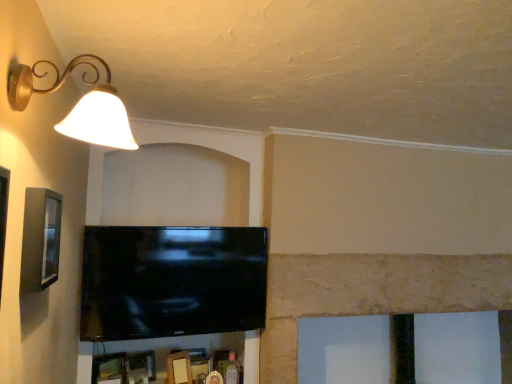
Question: Considering the relative positions of matte gold lampshade at upper left and black glossy tv at center in the image provided, is matte gold lampshade at upper left to the right of black glossy tv at center from the viewer's perspective?

Choices:
 (A) yes
 (B) no

Answer: (B)

Question: Can you confirm if matte gold lampshade at upper left is positioned to the left of black glossy tv at center?

Choices:
 (A) no
 (B) yes

Answer: (B)

Question: Is matte gold lampshade at upper left with black glossy tv at center?

Choices:
 (A) no
 (B) yes

Answer: (A)

Question: From a real-world perspective, is matte gold lampshade at upper left physically below black glossy tv at center?

Choices:
 (A) yes
 (B) no

Answer: (B)

Question: Can you confirm if matte gold lampshade at upper left is thinner than black glossy tv at center?

Choices:
 (A) yes
 (B) no

Answer: (B)

Question: From a real-world perspective, relative to matte gray picture frame at left, is matte gold lampshade at upper left vertically above or below?

Choices:
 (A) below
 (B) above

Answer: (B)

Question: From the image's perspective, is matte gold lampshade at upper left above or below matte gray picture frame at left?

Choices:
 (A) below
 (B) above

Answer: (B)

Question: Relative to matte gray picture frame at left, is matte gold lampshade at upper left in front or behind?

Choices:
 (A) front
 (B) behind

Answer: (A)

Question: In terms of width, does matte gold lampshade at upper left look wider or thinner when compared to matte gray picture frame at left?

Choices:
 (A) wide
 (B) thin

Answer: (A)

Question: Considering the relative positions of matte gray picture frame at left and black glossy tv at center in the image provided, is matte gray picture frame at left to the left or to the right of black glossy tv at center?

Choices:
 (A) right
 (B) left

Answer: (B)

Question: From the image's perspective, relative to black glossy tv at center, is matte gray picture frame at left above or below?

Choices:
 (A) below
 (B) above

Answer: (B)

Question: Is point (31, 218) positioned closer to the camera than point (132, 281)?

Choices:
 (A) farther
 (B) closer

Answer: (B)

Question: Looking at their shapes, would you say matte gray picture frame at left is wider or thinner than black glossy tv at center?

Choices:
 (A) wide
 (B) thin

Answer: (B)

Question: Is matte gray picture frame at left spatially inside matte gold lampshade at upper left, or outside of it?

Choices:
 (A) outside
 (B) inside

Answer: (A)

Question: From a real-world perspective, is matte gray picture frame at left positioned above or below matte gold lampshade at upper left?

Choices:
 (A) below
 (B) above

Answer: (A)